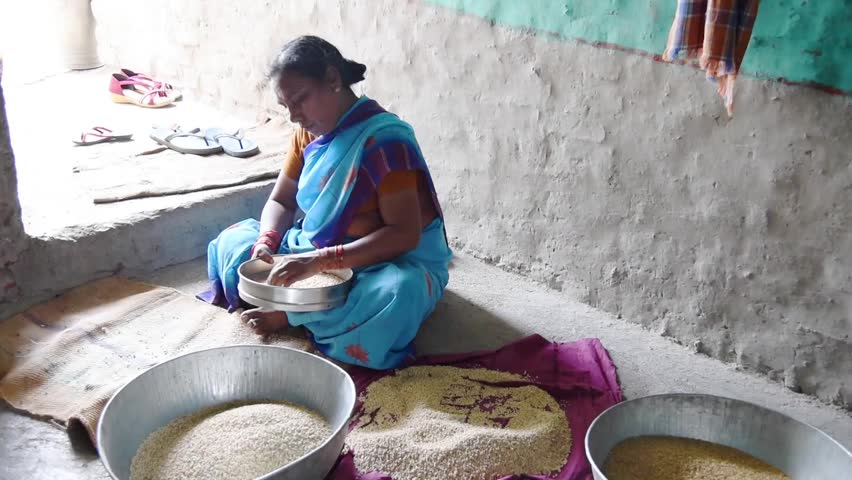
This screenshot has width=852, height=480. Identify the location of bowl to left of pink blanket. (239, 381).